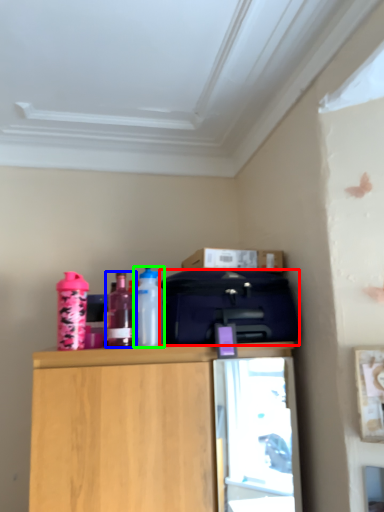
Question: Which object is positioned farthest from luggage (highlighted by a red box)? Select from bottle (highlighted by a blue box) and bottle (highlighted by a green box).

Choices:
 (A) bottle
 (B) bottle

Answer: (A)